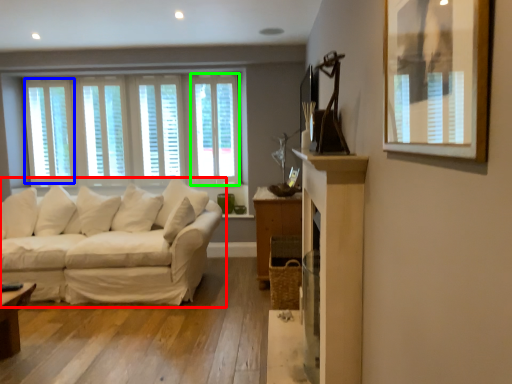
Question: Which is nearer to the studio couch (highlighted by a red box)? window (highlighted by a blue box) or window (highlighted by a green box).

Choices:
 (A) window
 (B) window

Answer: (B)